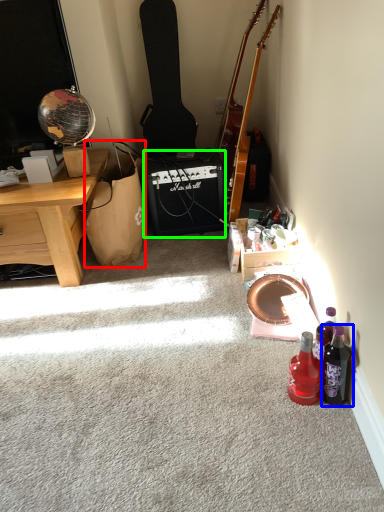
Question: Estimate the real-world distances between objects in this image. Which object is farther from handbag (highlighted by a red box), bottle (highlighted by a blue box) or loudspeaker (highlighted by a green box)?

Choices:
 (A) bottle
 (B) loudspeaker

Answer: (A)